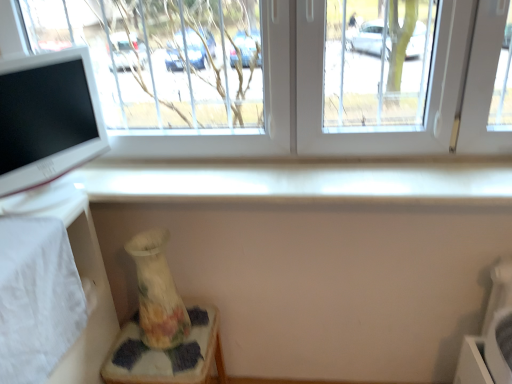
Measure the distance between point [139,309] and camera.

1.56 meters.

Image resolution: width=512 pixels, height=384 pixels. I want to click on porcelain floral vase at lower left, so click(167, 353).

Measure the distance between porcelain floral vase at lower left and camera.

4.33 feet.

Locate an element on the screen. The image size is (512, 384). white glossy computer monitor at left is located at coordinates (48, 118).

Is floral-patterned ceramic vase at lower left next to white fabric table at lower left and touching it?

No, floral-patterned ceramic vase at lower left is not making contact with white fabric table at lower left.

Considering the relative positions of floral-patterned ceramic vase at lower left and white fabric table at lower left in the image provided, is floral-patterned ceramic vase at lower left to the right of white fabric table at lower left from the viewer's perspective?

Correct, you'll find floral-patterned ceramic vase at lower left to the right of white fabric table at lower left.

Who is more distant, floral-patterned ceramic vase at lower left or white fabric table at lower left?

floral-patterned ceramic vase at lower left is further away from the camera.

Considering the sizes of objects floral-patterned ceramic vase at lower left and white fabric table at lower left in the image provided, who is wider, floral-patterned ceramic vase at lower left or white fabric table at lower left?

With larger width is white fabric table at lower left.

What's the angular difference between white glossy computer monitor at left and porcelain floral vase at lower left's facing directions?

The angle between the facing direction of white glossy computer monitor at left and the facing direction of porcelain floral vase at lower left is 63.4 degrees.

Which object is positioned more to the left, white glossy computer monitor at left or porcelain floral vase at lower left?

Positioned to the left is white glossy computer monitor at left.

Considering the sizes of white glossy computer monitor at left and porcelain floral vase at lower left in the image, is white glossy computer monitor at left wider or thinner than porcelain floral vase at lower left?

In the image, white glossy computer monitor at left appears to be more narrow than porcelain floral vase at lower left.

Choose the correct answer: Is white glossy computer monitor at left inside porcelain floral vase at lower left or outside it?

white glossy computer monitor at left is spatially situated outside porcelain floral vase at lower left.

Which of these two, transparent glass window at upper center or white fabric table at lower left, stands taller?

With more height is white fabric table at lower left.

Would you say transparent glass window at upper center contains white fabric table at lower left?

That's incorrect, white fabric table at lower left is not inside transparent glass window at upper center.

Can you confirm if transparent glass window at upper center is wider than white fabric table at lower left?

Incorrect, the width of transparent glass window at upper center does not surpass that of white fabric table at lower left.

Which is closer to the camera, (451, 97) or (109, 308)?

Point (451, 97).

Is point (181, 364) farther from camera compared to point (60, 132)?

Yes.

Identify the location of computer monitor above the porcelain floral vase at lower left (from the image's perspective). (48, 118).

Can you confirm if porcelain floral vase at lower left is bigger than white glossy computer monitor at left?

Yes.

Does porcelain floral vase at lower left have a lesser height compared to white glossy computer monitor at left?

No.

Between point (145, 263) and point (368, 143), which one is positioned behind?

The point (368, 143) is farther from the camera.

How many degrees apart are the facing directions of floral-patterned ceramic vase at lower left and transparent glass window at upper center?

There is a 5.57-degree angle between the facing directions of floral-patterned ceramic vase at lower left and transparent glass window at upper center.

Is the depth of floral-patterned ceramic vase at lower left greater than that of transparent glass window at upper center?

That is True.

Identify the location of window lying on the right of floral-patterned ceramic vase at lower left. (321, 98).

This screenshot has height=384, width=512. What are the coordinates of `computer monitor that appears on the right of white fabric table at lower left` in the screenshot? It's located at (x=48, y=118).

From the image's perspective, who appears lower, white fabric table at lower left or white glossy computer monitor at left?

From the image's view, white fabric table at lower left is below.

Is white fabric table at lower left facing towards white glossy computer monitor at left?

No, white fabric table at lower left is not aimed at white glossy computer monitor at left.

Is white fabric table at lower left not inside white glossy computer monitor at left?

That's correct, white fabric table at lower left is outside of white glossy computer monitor at left.

From the image's perspective, which object appears higher, white fabric table at lower left or transparent glass window at upper center?

transparent glass window at upper center.

Based on their positions, is white fabric table at lower left located to the left or right of transparent glass window at upper center?

white fabric table at lower left is positioned on transparent glass window at upper center's left side.

Which is correct: white fabric table at lower left is inside transparent glass window at upper center, or outside of it?

white fabric table at lower left lies outside transparent glass window at upper center.

Measure the distance between white fabric table at lower left and transparent glass window at upper center.

white fabric table at lower left is 24.90 inches from transparent glass window at upper center.

The width and height of the screenshot is (512, 384). I want to click on vase that appears on the right of white fabric table at lower left, so click(157, 292).

Find the location of a particular element. The height and width of the screenshot is (384, 512). computer monitor that is on the left side of porcelain floral vase at lower left is located at coordinates (48, 118).

From the image, which object appears to be farther from porcelain floral vase at lower left, white fabric table at lower left or white glossy computer monitor at left?

The object further to porcelain floral vase at lower left is white glossy computer monitor at left.

Which object lies nearer to the anchor point transparent glass window at upper center, white fabric table at lower left or white glossy computer monitor at left?

white glossy computer monitor at left lies closer to transparent glass window at upper center than the other object.

When comparing their distances from white fabric table at lower left, does floral-patterned ceramic vase at lower left or transparent glass window at upper center seem closer?

floral-patterned ceramic vase at lower left lies closer to white fabric table at lower left than the other object.

Which object lies nearer to the anchor point white fabric table at lower left, floral-patterned ceramic vase at lower left or porcelain floral vase at lower left?

Among the two, floral-patterned ceramic vase at lower left is located nearer to white fabric table at lower left.

Estimate the real-world distances between objects in this image. Which object is further from white glossy computer monitor at left, floral-patterned ceramic vase at lower left or porcelain floral vase at lower left?

porcelain floral vase at lower left.

From the image, which object appears to be farther from porcelain floral vase at lower left, transparent glass window at upper center or white glossy computer monitor at left?

The object further to porcelain floral vase at lower left is transparent glass window at upper center.

Considering their positions, is transparent glass window at upper center positioned closer to floral-patterned ceramic vase at lower left than white fabric table at lower left?

Among the two, white fabric table at lower left is located nearer to floral-patterned ceramic vase at lower left.

Consider the image. Looking at the image, which one is located further to porcelain floral vase at lower left, white glossy computer monitor at left or floral-patterned ceramic vase at lower left?

white glossy computer monitor at left is further to porcelain floral vase at lower left.

At what (x,y) coordinates should I click in order to perform the action: click on vase between white glossy computer monitor at left and white fabric table at lower left from top to bottom. Please return your answer as a coordinate pair (x, y). The image size is (512, 384). Looking at the image, I should click on (157, 292).

This screenshot has height=384, width=512. What are the coordinates of `table between transparent glass window at upper center and porcelain floral vase at lower left in the up-down direction` in the screenshot? It's located at (79, 274).

Identify the location of computer monitor between transparent glass window at upper center and floral-patterned ceramic vase at lower left from top to bottom. The image size is (512, 384). pos(48,118).

Locate an element on the screen. vase that lies between white glossy computer monitor at left and porcelain floral vase at lower left from top to bottom is located at coordinates [x=157, y=292].